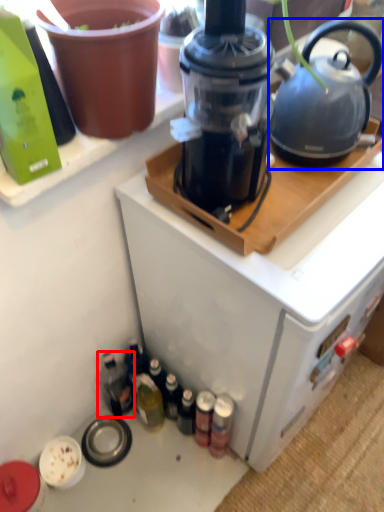
Question: Which point is further to the camera, bottle (highlighted by a red box) or kettle (highlighted by a blue box)?

Choices:
 (A) bottle
 (B) kettle

Answer: (A)